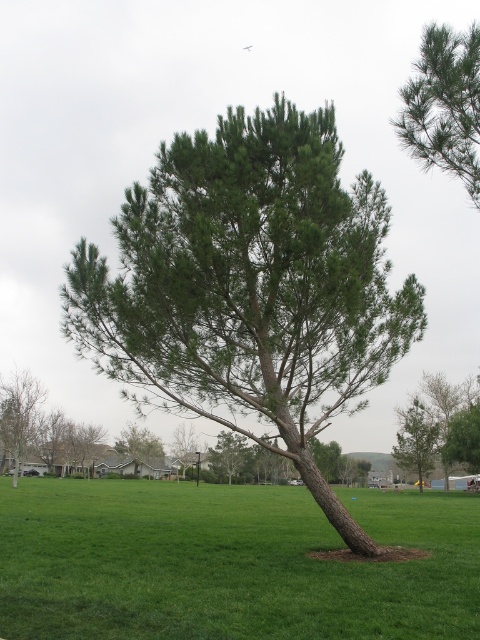
Between green grassy field at center and green matte tree at lower right, which one is positioned lower?

green matte tree at lower right is lower down.

Between green grassy field at center and green matte tree at lower right, which one appears on the right side from the viewer's perspective?

green matte tree at lower right

Who is more forward, (262, 538) or (411, 460)?

Point (262, 538)

The width and height of the screenshot is (480, 640). I want to click on green grassy field at center, so click(x=228, y=563).

Locate an element on the screen. This screenshot has width=480, height=640. brown leafy tree at lower left is located at coordinates (20, 416).

Is brown leafy tree at lower left above green leafy tree at center?

Yes.

Which is in front, point (41, 401) or point (136, 445)?

Point (41, 401) is in front.

You are a GUI agent. You are given a task and a screenshot of the screen. Output one action in this format:
    pyautogui.click(x=<x>, y=<y>)
    Task: Click on the brown leafy tree at lower left
    The height and width of the screenshot is (640, 480).
    Given the screenshot: What is the action you would take?
    pyautogui.click(x=20, y=416)

Is green needle-like leaves at upper right smaller than green matte tree at lower right?

Yes.

Describe the element at coordinates (444, 106) in the screenshot. I see `green needle-like leaves at upper right` at that location.

You are a GUI agent. You are given a task and a screenshot of the screen. Output one action in this format:
    pyautogui.click(x=<x>, y=<y>)
    Task: Click on the green needle-like leaves at upper right
    
    Given the screenshot: What is the action you would take?
    point(444,106)